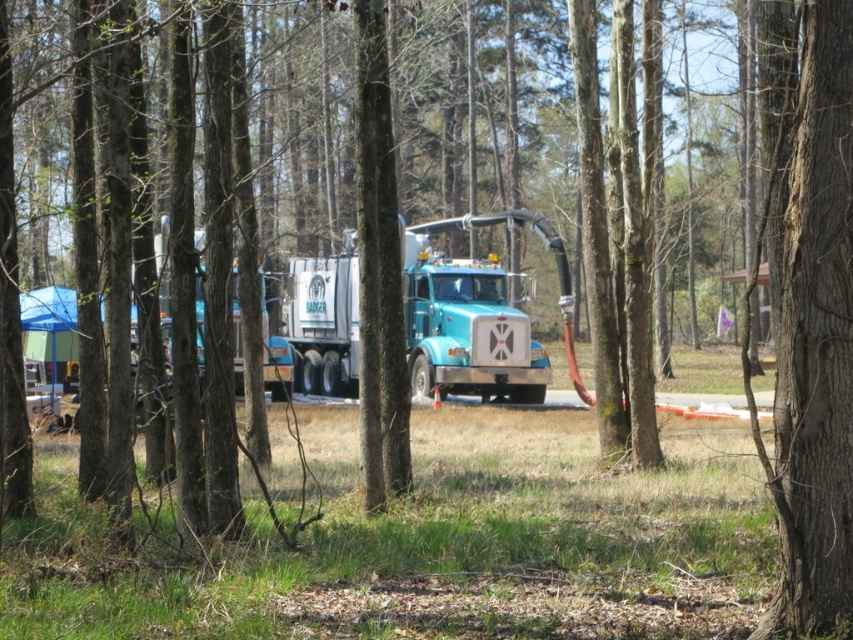
Question: Is smooth bark tree at center positioned before teal metallic truck at center?

Choices:
 (A) yes
 (B) no

Answer: (A)

Question: Which of the following is the farthest from the observer?

Choices:
 (A) (809, 0)
 (B) (428, 289)

Answer: (B)

Question: Which point is farther to the camera?

Choices:
 (A) (306, 259)
 (B) (805, 269)

Answer: (A)

Question: Considering the relative positions of smooth bark tree at center and teal metallic truck at center in the image provided, where is smooth bark tree at center located with respect to teal metallic truck at center?

Choices:
 (A) below
 (B) above

Answer: (A)

Question: Considering the relative positions of smooth bark tree at center and teal metallic truck at center in the image provided, where is smooth bark tree at center located with respect to teal metallic truck at center?

Choices:
 (A) left
 (B) right

Answer: (B)